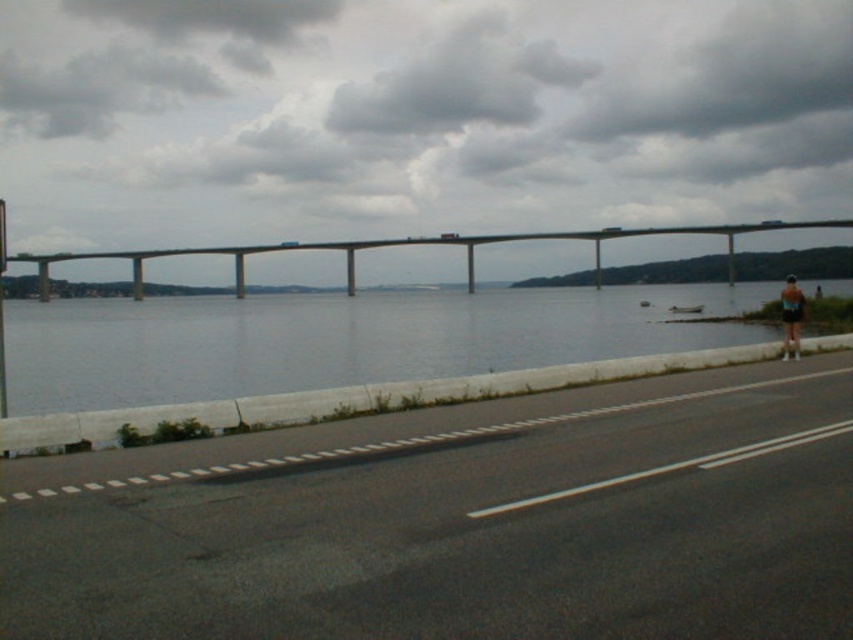
Is concrete bridge at center closer to the viewer compared to metallic street sign at left?

No, concrete bridge at center is further to the viewer.

Image resolution: width=853 pixels, height=640 pixels. What do you see at coordinates (412, 244) in the screenshot?
I see `concrete bridge at center` at bounding box center [412, 244].

This screenshot has width=853, height=640. What are the coordinates of `concrete bridge at center` in the screenshot? It's located at coord(412,244).

Does black asphalt highway at center have a lesser height compared to metallic street sign at left?

Yes, black asphalt highway at center is shorter than metallic street sign at left.

Between point (347, 429) and point (1, 273), which one is positioned behind?

Positioned behind is point (1, 273).

Measure the distance between black asphalt highway at center and camera.

They are 4.25 meters apart.

Identify the location of black asphalt highway at center. (460, 522).

Between black asphalt highway at center and black matte shorts at right, which one appears on the left side from the viewer's perspective?

black asphalt highway at center

Does black asphalt highway at center have a smaller size compared to black matte shorts at right?

Indeed, black asphalt highway at center has a smaller size compared to black matte shorts at right.

Who is more distant from viewer, (505, 545) or (790, 352)?

The point (790, 352) is more distant.

The width and height of the screenshot is (853, 640). In order to click on black asphalt highway at center in this screenshot , I will do `click(460, 522)`.